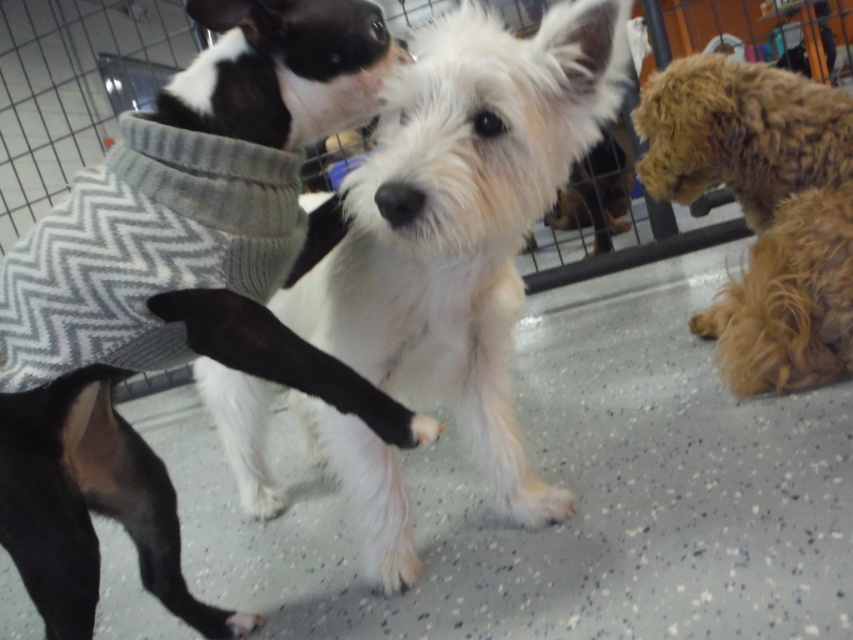
Question: Does black and white sweater at upper left appear on the right side of white fluffy dog at center?

Choices:
 (A) yes
 (B) no

Answer: (B)

Question: Which object is positioned farthest from the white fluffy dog at center?

Choices:
 (A) black and white sweater at upper left
 (B) fuzzy brown dog at right

Answer: (B)

Question: Considering the real-world distances, which object is closest to the black and white sweater at upper left?

Choices:
 (A) fuzzy brown dog at right
 (B) white fluffy dog at center

Answer: (B)

Question: Estimate the real-world distances between objects in this image. Which object is closer to the black and white sweater at upper left?

Choices:
 (A) white fluffy dog at center
 (B) fuzzy brown dog at right

Answer: (A)

Question: Considering the relative positions of black and white sweater at upper left and white fluffy dog at center in the image provided, where is black and white sweater at upper left located with respect to white fluffy dog at center?

Choices:
 (A) left
 (B) right

Answer: (A)

Question: Considering the relative positions of black and white sweater at upper left and fuzzy brown dog at right in the image provided, where is black and white sweater at upper left located with respect to fuzzy brown dog at right?

Choices:
 (A) right
 (B) left

Answer: (B)